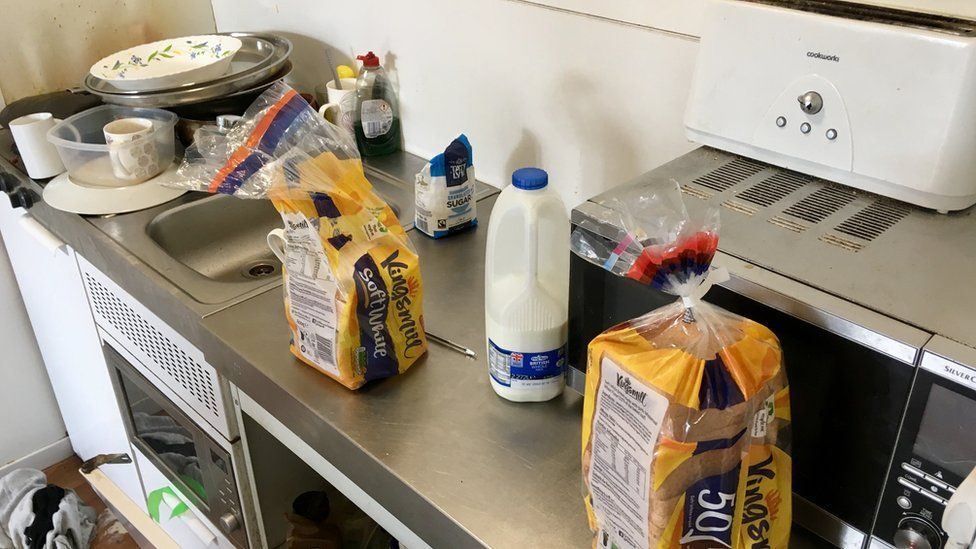
Locate an element on the screen. The height and width of the screenshot is (549, 976). cups is located at coordinates (30, 128), (127, 128).